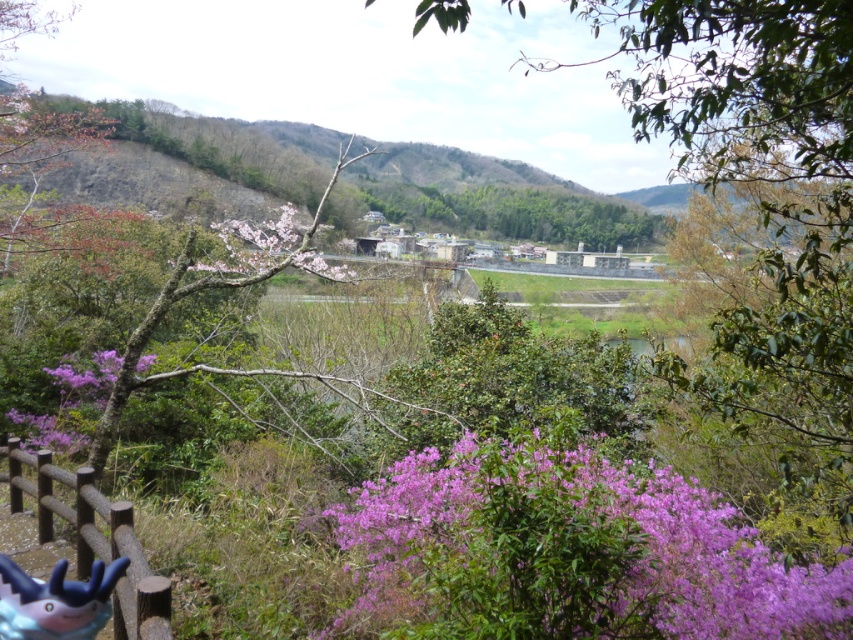
You are a child playing in this garden and you see the plastic toy at lower left and the pink blossoms at center. Which object would look bigger to you when you look at them from where you are standing?

The pink blossoms at center appear larger than the plastic toy at lower left because the plastic toy at lower left is smaller than pink blossoms at center.